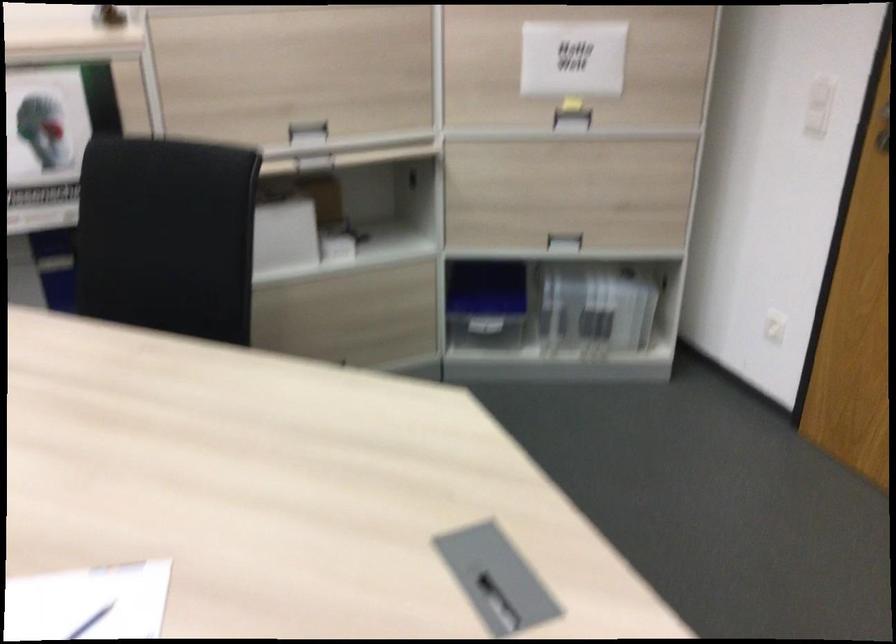
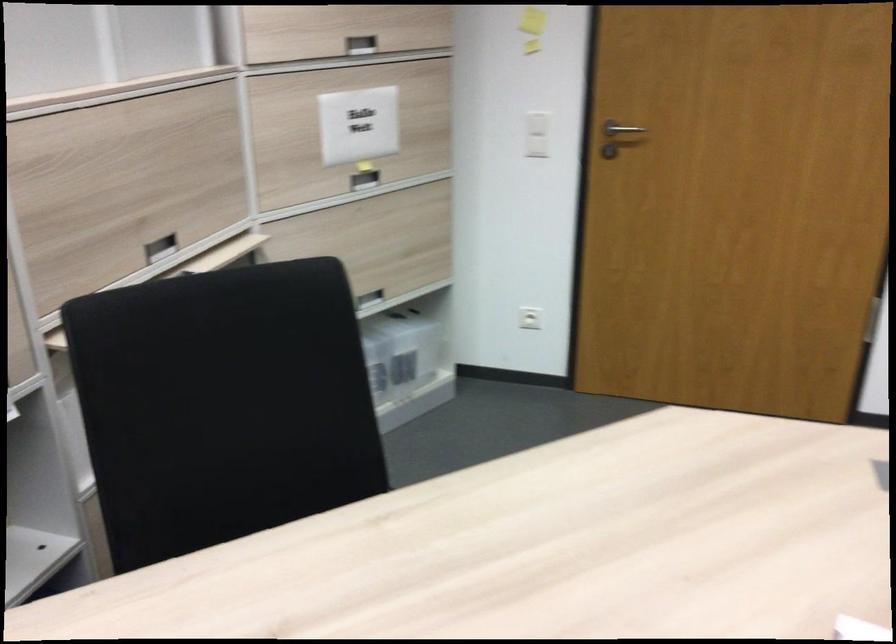
Find the pixel in the second image that matches point (569, 120) in the first image.

(364, 180)